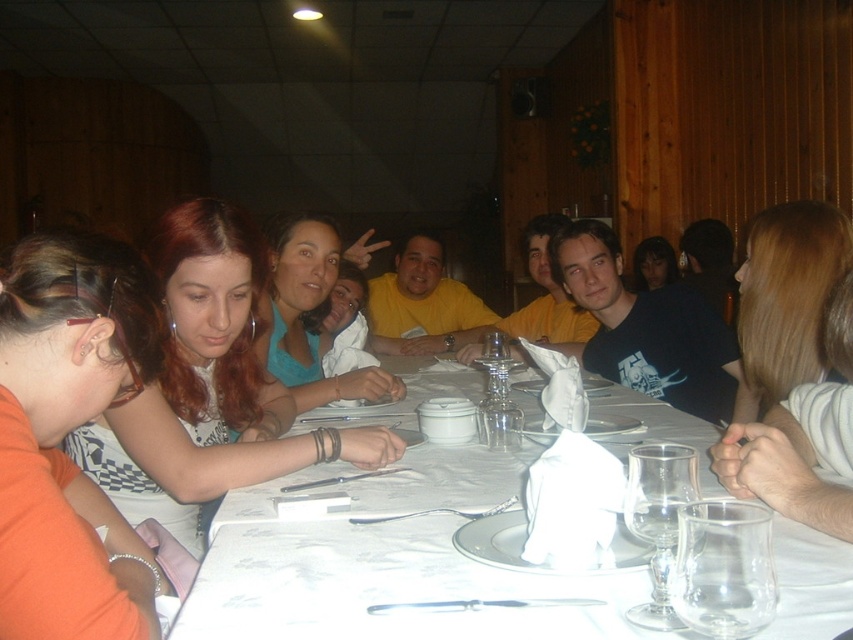
Is point (318, 371) positioned in front of point (722, 579)?

No, (318, 371) is further to viewer.

Which is more to the right, teal matte shirt at center or transparent glass at table center?

transparent glass at table center is more to the right.

Is point (329, 237) positioned behind point (740, 524)?

That is True.

You are a GUI agent. You are given a task and a screenshot of the screen. Output one action in this format:
    pyautogui.click(x=<x>, y=<y>)
    Task: Click on the teal matte shirt at center
    Image resolution: width=853 pixels, height=640 pixels.
    Given the screenshot: What is the action you would take?
    pyautogui.click(x=310, y=317)

Does white paper napkin at center appear under transparent glass wine glass at center?

Indeed, white paper napkin at center is positioned under transparent glass wine glass at center.

Who is more distant from viewer, (691, 440) or (486, 360)?

The point (486, 360) is more distant.

Locate an element on the screen. white paper napkin at center is located at coordinates (366, 580).

Who is positioned more to the left, matte orange shirt at lower left or teal matte shirt at center?

matte orange shirt at lower left is more to the left.

Does matte orange shirt at lower left have a lesser height compared to teal matte shirt at center?

Yes, matte orange shirt at lower left is shorter than teal matte shirt at center.

The image size is (853, 640). Find the location of `matte orange shirt at lower left`. matte orange shirt at lower left is located at coordinates (67, 433).